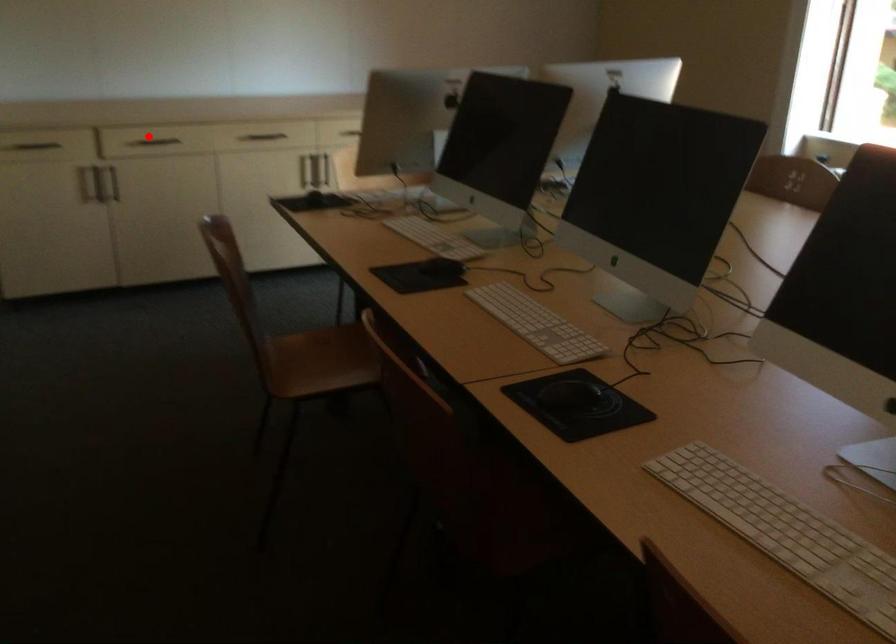
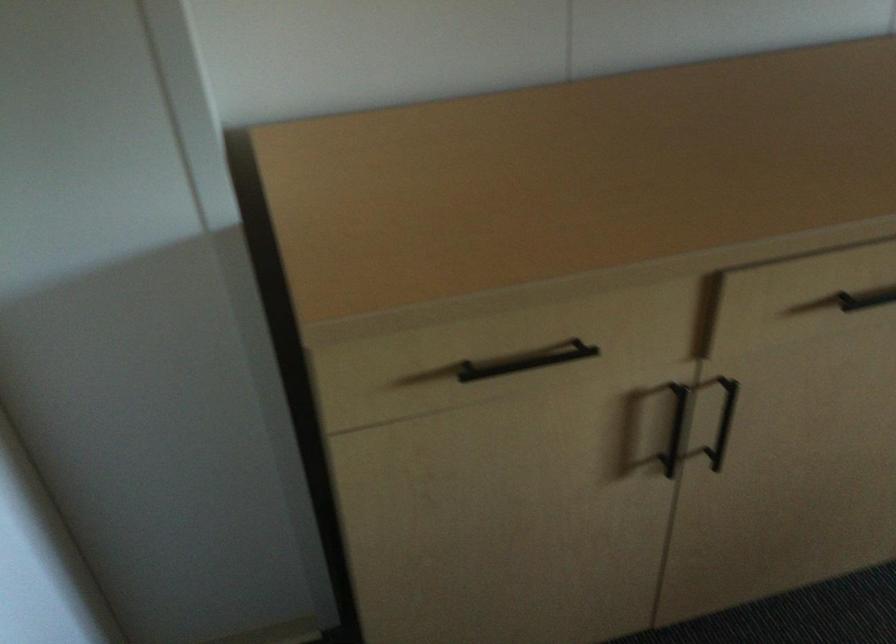
The point at the highlighted location is marked in the first image. Where is the corresponding point in the second image?

(866, 299)